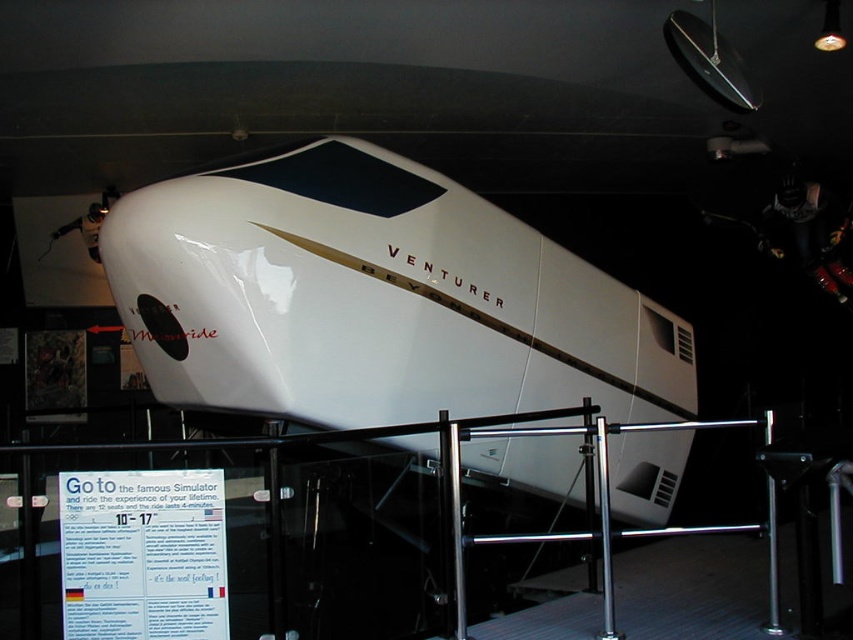
Question: Which of the following is the farthest from the observer?

Choices:
 (A) polished metal railing at lower center
 (B) white glossy bullet train at center

Answer: (B)

Question: Is white glossy bullet train at center wider than polished metal railing at lower center?

Choices:
 (A) yes
 (B) no

Answer: (A)

Question: Can you confirm if white glossy bullet train at center is positioned to the left of polished metal railing at lower center?

Choices:
 (A) no
 (B) yes

Answer: (A)

Question: Does white glossy bullet train at center appear under polished metal railing at lower center?

Choices:
 (A) no
 (B) yes

Answer: (A)

Question: Among these points, which one is farthest from the camera?

Choices:
 (A) (361, 252)
 (B) (767, 490)

Answer: (A)